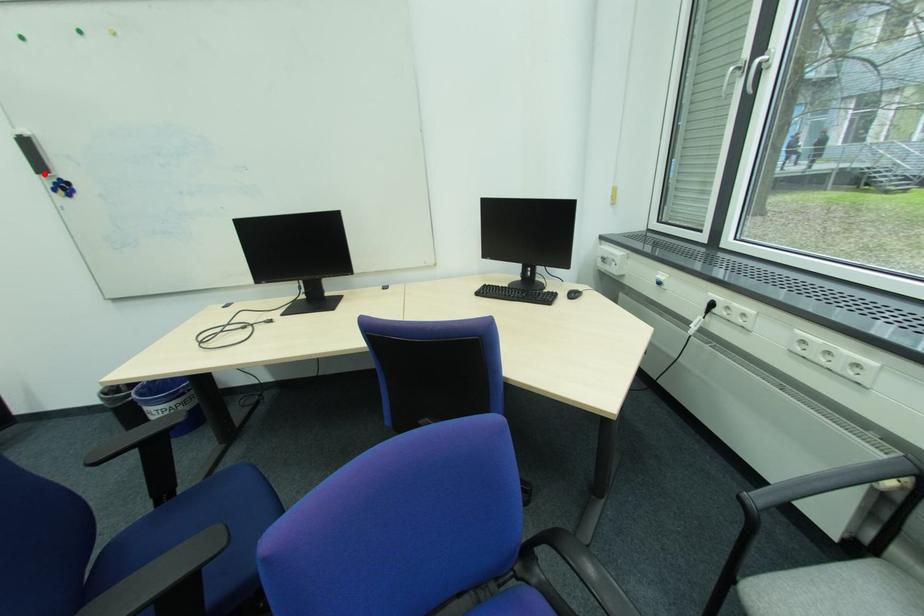
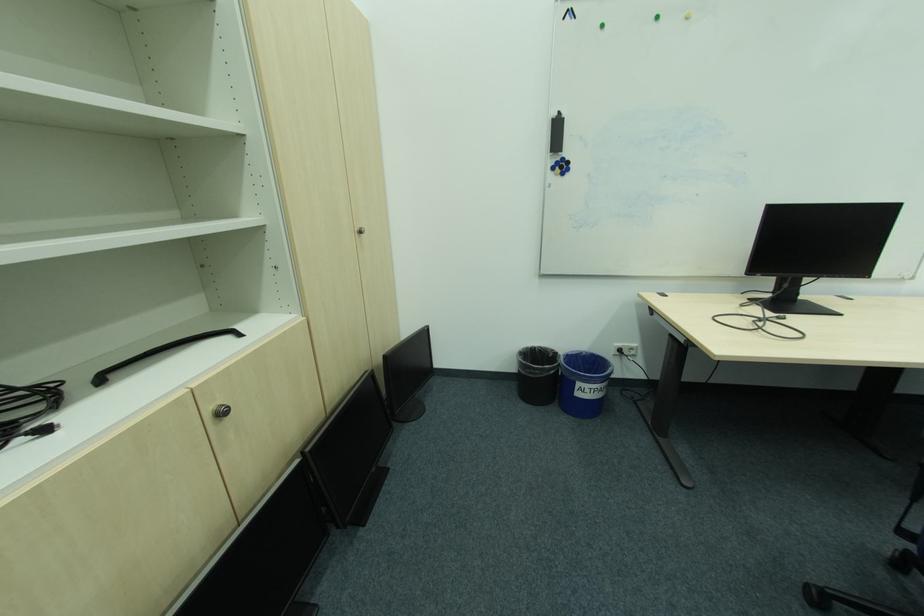
Question: I am providing you with two images of the same scene from different viewpoints. A red point is shown in image1. For the corresponding object point in image2, is it positioned nearer or farther from the camera?

Choices:
 (A) Nearer
 (B) Farther

Answer: (A)